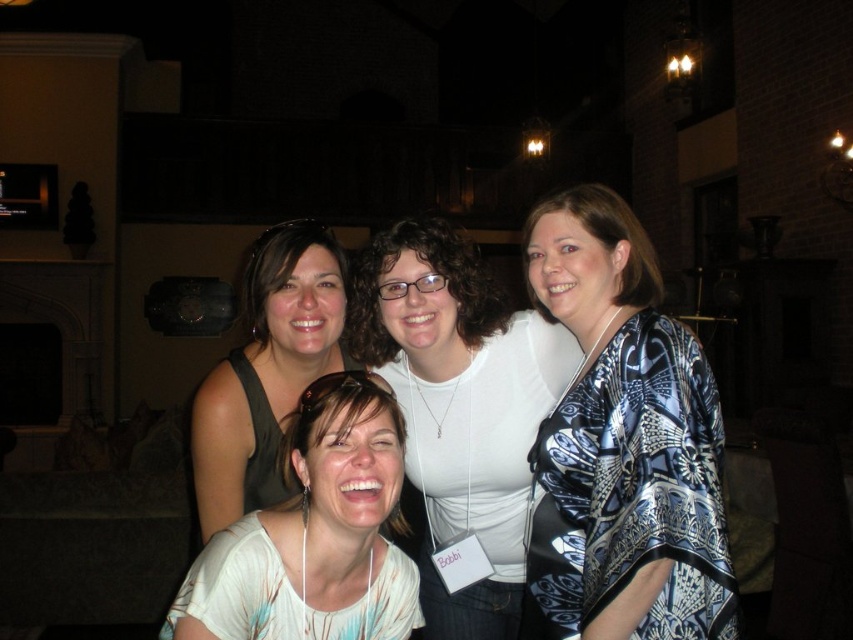
You are a photographer at the event and want to capture a closeup of the white fabric shirt at center without the blue patterned shawl at center covering it. Is this possible based on their current positions?

The blue patterned shawl at center is positioned over the white fabric shirt at center, so it is currently covering it. To capture a closeup of the white fabric shirt at center without the shawl, the subject would need to adjust their clothing or move the shawl aside.

You are organizing a photo shoot and need to ensure that all clothing items are visible in the final image. Given that the blue patterned shawl at center and the white matte shirt at center are both central to the composition, which clothing item might require more careful positioning to ensure it doesn not get lost in the frame?

The blue patterned shawl at center has a smaller size compared to white matte shirt at center, so it might require more careful positioning to ensure it doesn not get lost in the frame.

Looking at this image, you are a photographer at the event and want to ensure both the blue patterned shawl at center and the matte black shirt at center are clearly visible in your photo. Which object should you focus on to capture both effectively?

Since the blue patterned shawl at center is closer to the viewer than the matte black shirt at center, focusing on the matte black shirt at center will keep both in focus due to the depth of field.